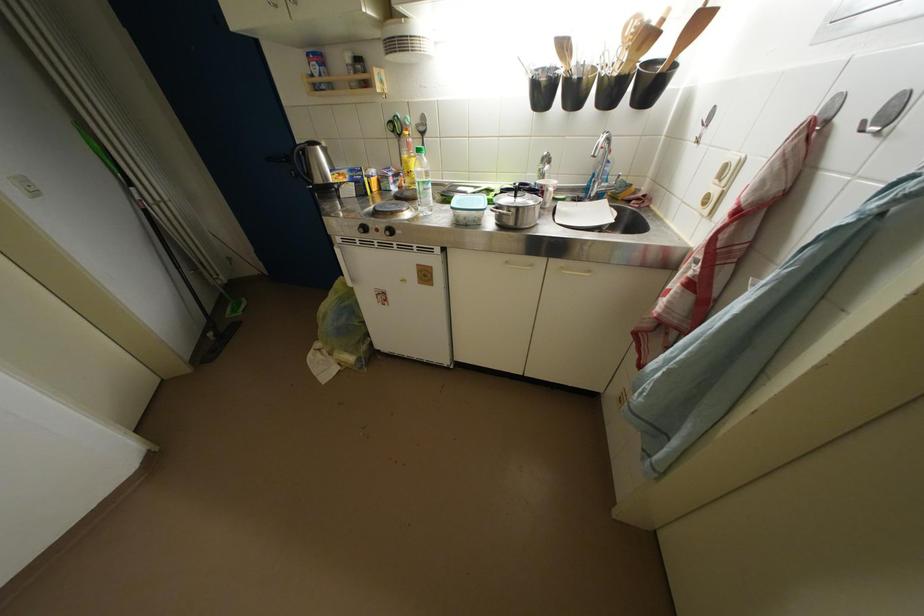
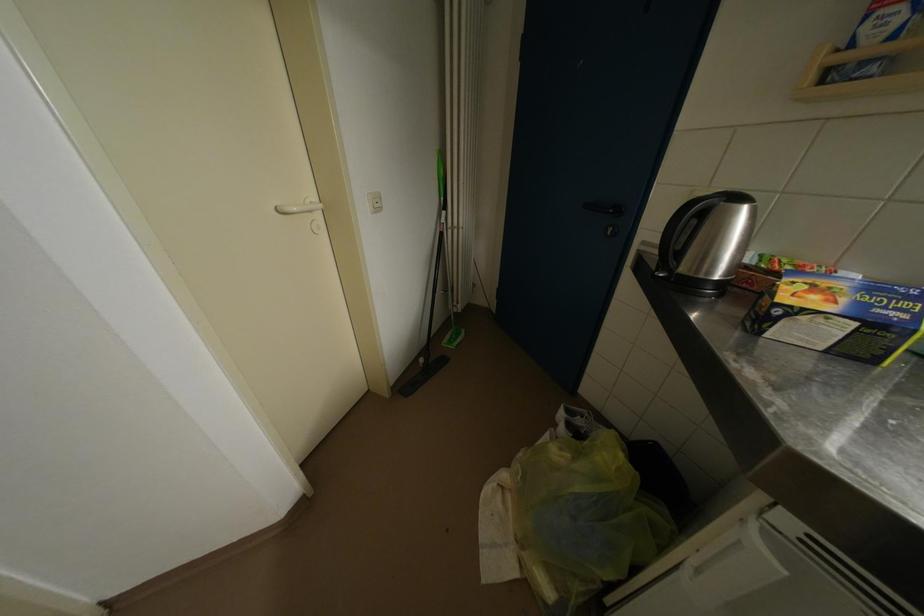
Question: The camera is either moving clockwise (left) or counter-clockwise (right) around the object. The first image is from the beginning of the video and the second image is from the end. Is the camera moving left or right when shooting the video?

Choices:
 (A) Left
 (B) Right

Answer: (B)